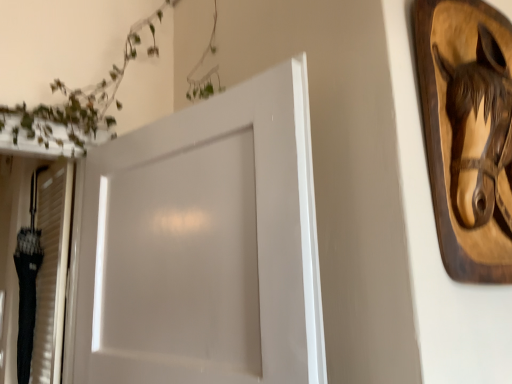
Question: Considering the relative sizes of wooden horse head at upper right and white glossy door at center in the image provided, is wooden horse head at upper right taller than white glossy door at center?

Choices:
 (A) yes
 (B) no

Answer: (B)

Question: Is wooden horse head at upper right outside of white glossy door at center?

Choices:
 (A) yes
 (B) no

Answer: (A)

Question: Considering the relative sizes of wooden horse head at upper right and white glossy door at center in the image provided, is wooden horse head at upper right wider than white glossy door at center?

Choices:
 (A) yes
 (B) no

Answer: (B)

Question: Is wooden horse head at upper right beside white glossy door at center?

Choices:
 (A) no
 (B) yes

Answer: (A)

Question: Considering the relative positions of wooden horse head at upper right and white glossy door at center in the image provided, is wooden horse head at upper right in front of white glossy door at center?

Choices:
 (A) no
 (B) yes

Answer: (A)

Question: Is white glossy door at center a part of wooden horse head at upper right?

Choices:
 (A) no
 (B) yes

Answer: (A)

Question: Is white glossy door at center bigger than wooden horse head at upper right?

Choices:
 (A) yes
 (B) no

Answer: (A)

Question: From a real-world perspective, is white glossy door at center over wooden horse head at upper right?

Choices:
 (A) no
 (B) yes

Answer: (A)

Question: Is white glossy door at center oriented away from wooden horse head at upper right?

Choices:
 (A) no
 (B) yes

Answer: (A)

Question: Is white glossy door at center smaller than wooden horse head at upper right?

Choices:
 (A) no
 (B) yes

Answer: (A)

Question: Is wooden horse head at upper right located within white glossy door at center?

Choices:
 (A) yes
 (B) no

Answer: (B)

Question: From the image's perspective, would you say white glossy door at center is shown under wooden horse head at upper right?

Choices:
 (A) no
 (B) yes

Answer: (B)

Question: Looking at their shapes, would you say white glossy door at center is wider or thinner than wooden horse head at upper right?

Choices:
 (A) thin
 (B) wide

Answer: (B)